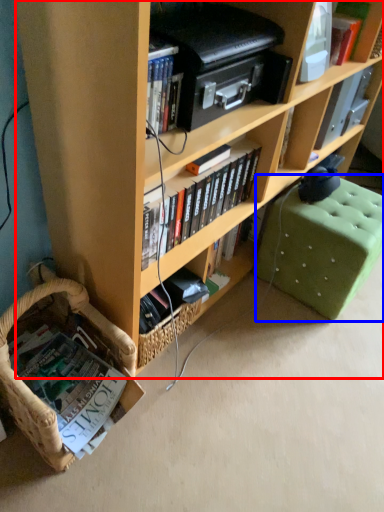
Question: Which of the following is the farthest to the observer, bookcase (highlighted by a red box) or swivel chair (highlighted by a blue box)?

Choices:
 (A) bookcase
 (B) swivel chair

Answer: (B)